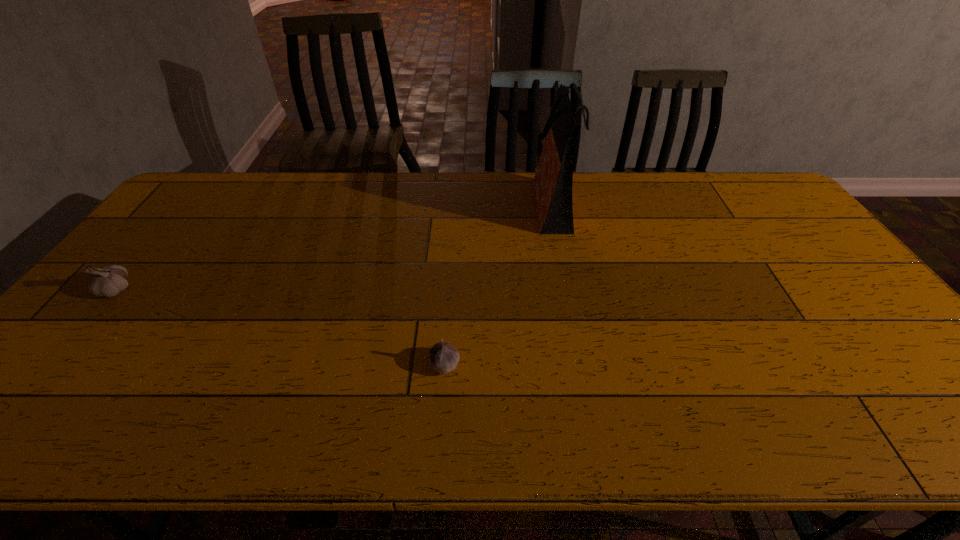
The width and height of the screenshot is (960, 540). What are the coordinates of `free spot between the farther garlic and the farthest object` in the screenshot? It's located at (335, 247).

Find the location of a particular element. free space between the second nearest object and the farthest object is located at coordinates (335, 247).

Identify the location of free spot between the shopping bag and the nearest object. The height and width of the screenshot is (540, 960). (498, 284).

At what (x,y) coordinates should I click in order to perform the action: click on free space between the shorter garlic and the taller garlic. Please return your answer as a coordinate pair (x, y). This screenshot has width=960, height=540. Looking at the image, I should click on (280, 327).

I want to click on free space between the shortest object and the farthest object, so click(498, 284).

The width and height of the screenshot is (960, 540). Identify the location of vacant area that lies between the tallest object and the right garlic. (498, 284).

Find the location of a particular element. empty location between the tallest object and the second shortest object is located at coordinates (335, 247).

This screenshot has height=540, width=960. In order to click on free space between the rightmost object and the nearest object in this screenshot , I will do `click(498, 284)`.

You are a GUI agent. You are given a task and a screenshot of the screen. Output one action in this format:
    pyautogui.click(x=<x>, y=<y>)
    Task: Click on the closest object relative to the second nearest object
    This screenshot has width=960, height=540.
    Given the screenshot: What is the action you would take?
    pyautogui.click(x=443, y=357)

The height and width of the screenshot is (540, 960). In order to click on object that is the closest to the taller garlic in this screenshot , I will do `click(443, 357)`.